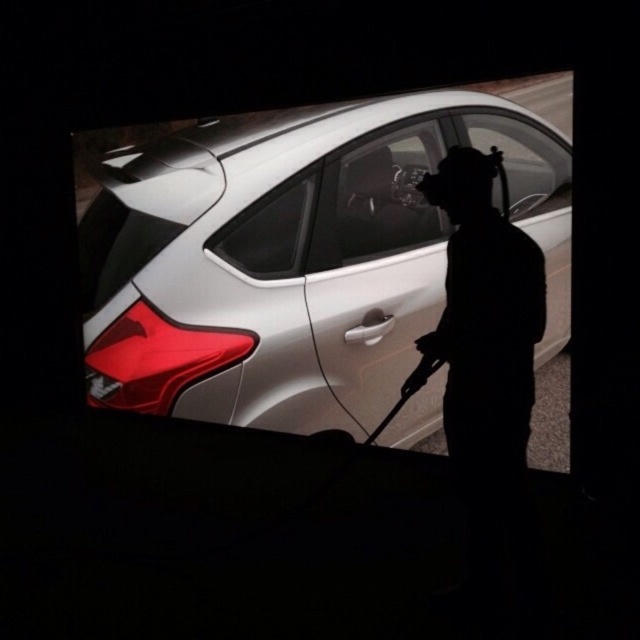
Question: From the image, what is the correct spatial relationship of satin silver car at center in relation to clear glass window at center?

Choices:
 (A) right
 (B) left

Answer: (B)

Question: Does satin silver car at center appear on the left side of clear glass window at center?

Choices:
 (A) no
 (B) yes

Answer: (B)

Question: Which point appears farthest from the camera in this image?

Choices:
 (A) (493, 237)
 (B) (515, 211)
 (C) (243, 138)

Answer: (C)

Question: Can you confirm if satin silver car at center is bigger than clear glass window at center?

Choices:
 (A) no
 (B) yes

Answer: (B)

Question: Which point is closer to the camera?

Choices:
 (A) silhouette figure at center
 (B) clear glass window at center

Answer: (A)

Question: Which of the following is the farthest from the observer?

Choices:
 (A) (282, 419)
 (B) (236, 246)

Answer: (B)